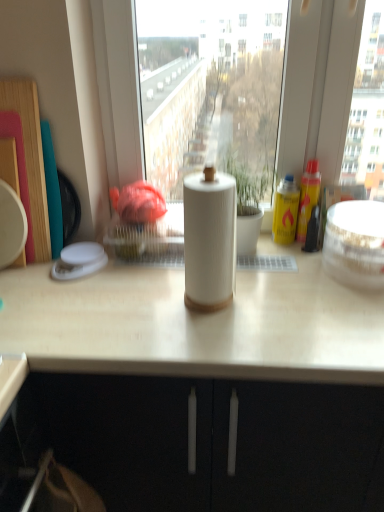
I want to click on vacant area that is in front of white plastic container at left, the first appliance viewed from the left, so click(65, 300).